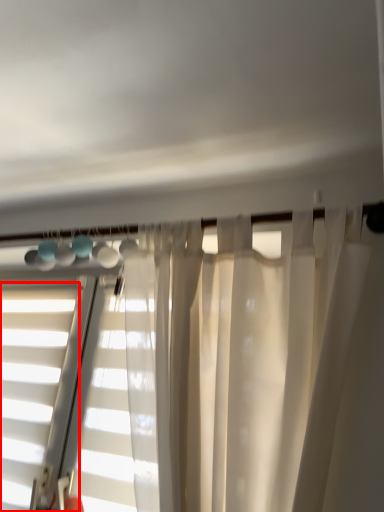
Question: In this image, where is window (annotated by the red box) located relative to bay window?

Choices:
 (A) left
 (B) right

Answer: (A)